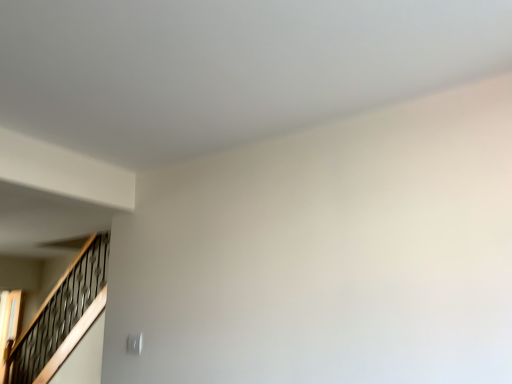
Identify the location of wooden screen door at lower left. (8, 325).

Image resolution: width=512 pixels, height=384 pixels. Describe the element at coordinates (8, 325) in the screenshot. I see `wooden screen door at lower left` at that location.

What are the coordinates of `wooden screen door at lower left` in the screenshot? It's located at (8, 325).